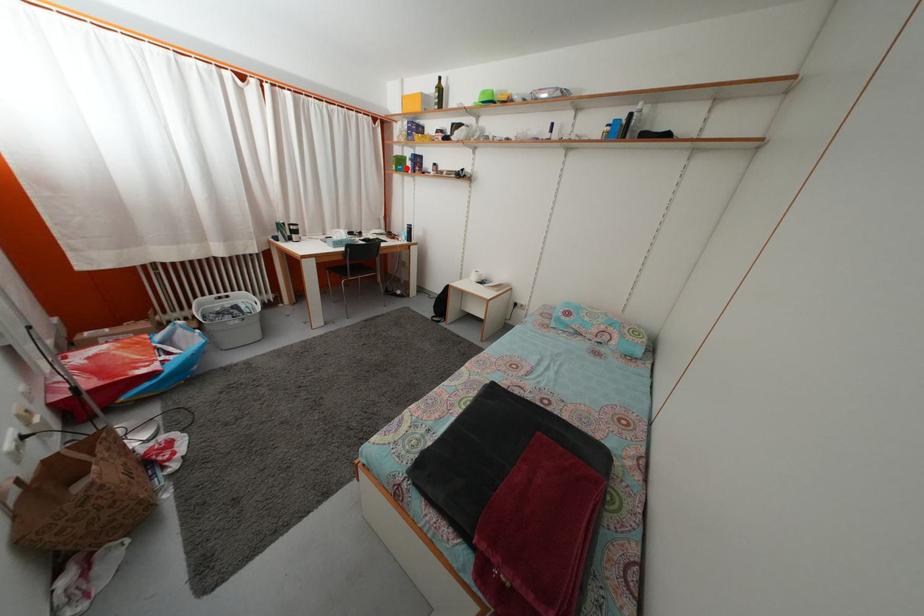
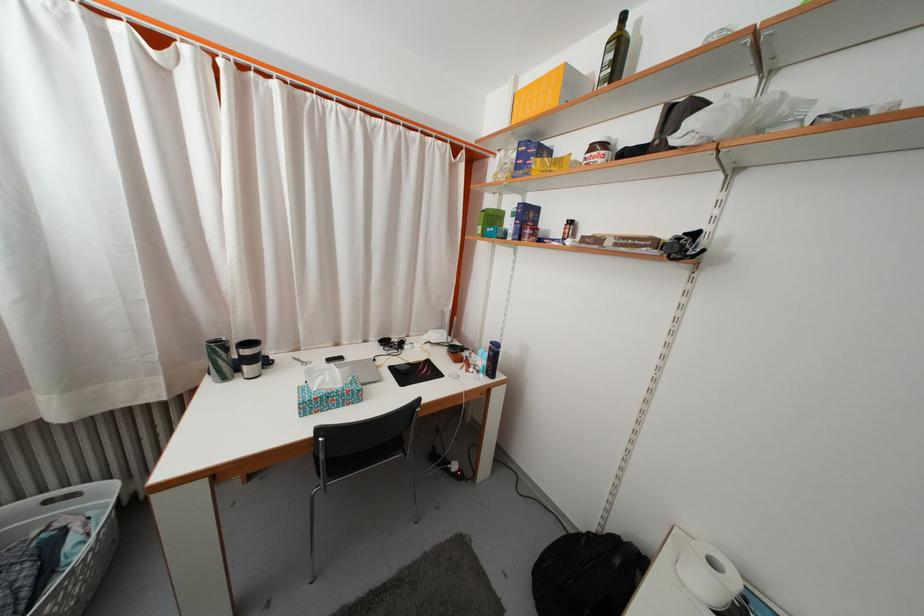
The point at the highlighted location is marked in the first image. Where is the corresponding point in the second image?

(500, 225)